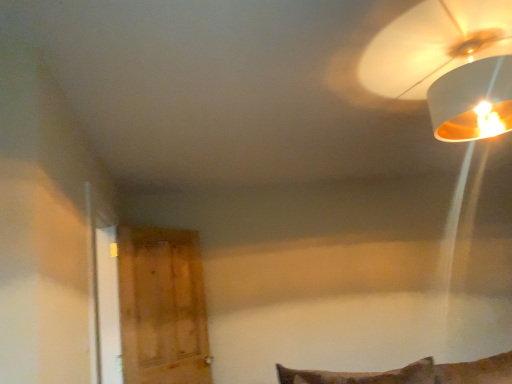
Question: From the image's perspective, is wooden door at left above or below white matte lampshade at upper right?

Choices:
 (A) below
 (B) above

Answer: (A)

Question: Would you say wooden door at left is inside or outside white matte lampshade at upper right?

Choices:
 (A) outside
 (B) inside

Answer: (A)

Question: Looking at their shapes, would you say wooden door at left is wider or thinner than white matte lampshade at upper right?

Choices:
 (A) wide
 (B) thin

Answer: (B)

Question: From their relative heights in the image, would you say white matte lampshade at upper right is taller or shorter than wooden door at left?

Choices:
 (A) tall
 (B) short

Answer: (B)

Question: Based on their positions, is white matte lampshade at upper right located to the left or right of wooden door at left?

Choices:
 (A) left
 (B) right

Answer: (B)

Question: Do you think white matte lampshade at upper right is within wooden door at left, or outside of it?

Choices:
 (A) inside
 (B) outside

Answer: (B)

Question: From the image's perspective, is white matte lampshade at upper right above or below wooden door at left?

Choices:
 (A) above
 (B) below

Answer: (A)